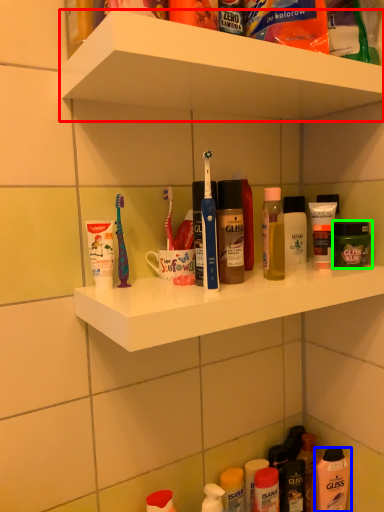
Question: Estimate the real-world distances between objects in this image. Which object is farther from supermarket shelf (highlighted by a red box), mouthwash (highlighted by a blue box) or toiletry (highlighted by a green box)?

Choices:
 (A) mouthwash
 (B) toiletry

Answer: (A)